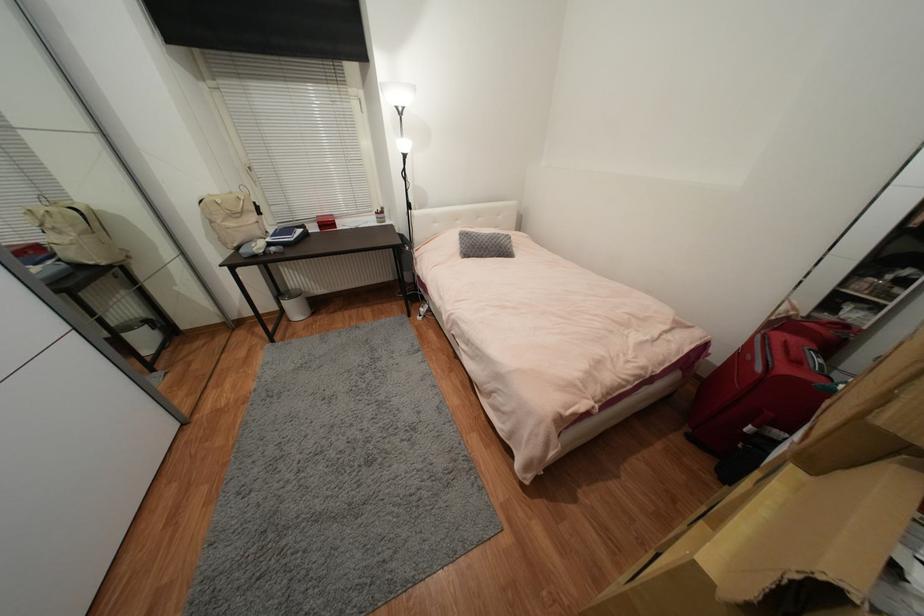
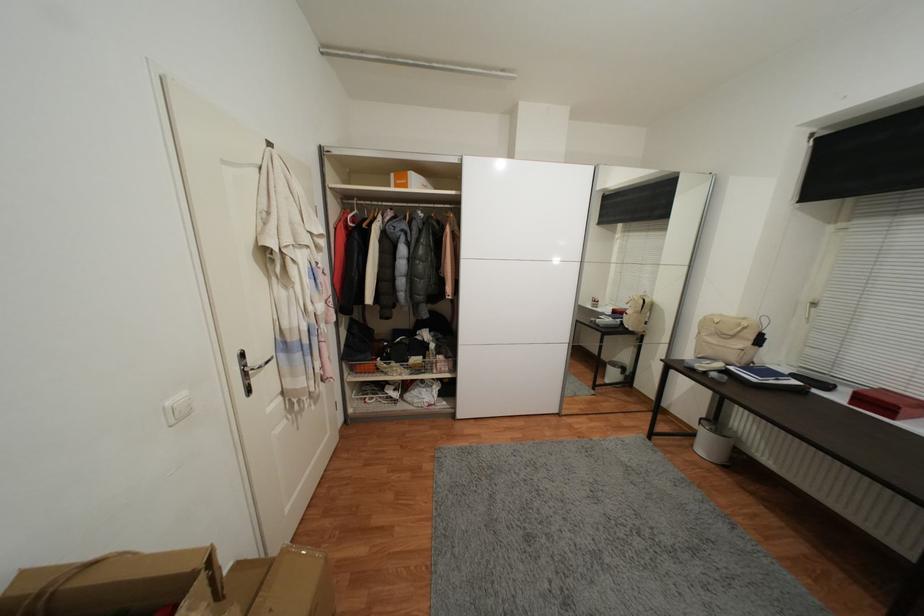
Locate, in the second image, the point that corresponds to the point at 294,322 in the first image.

(697, 447)